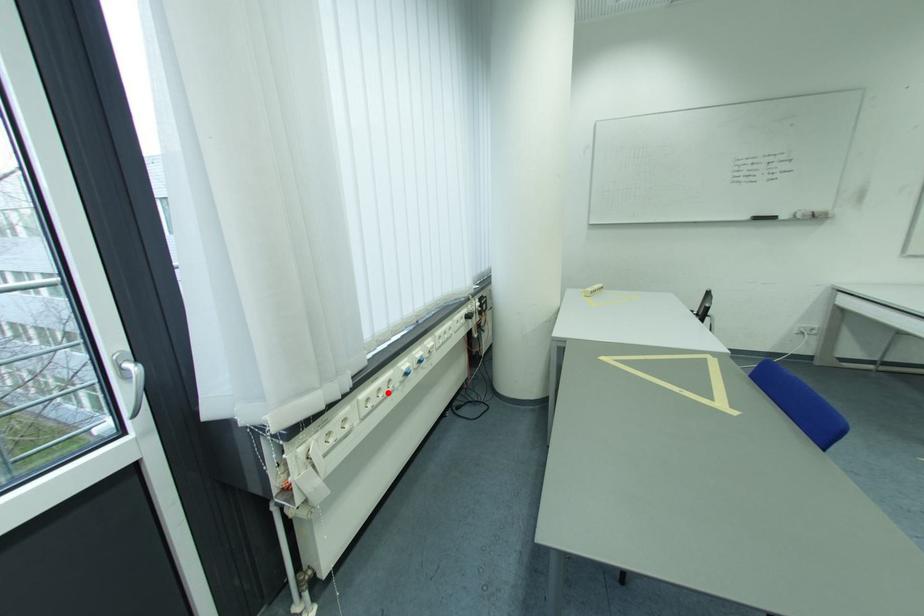
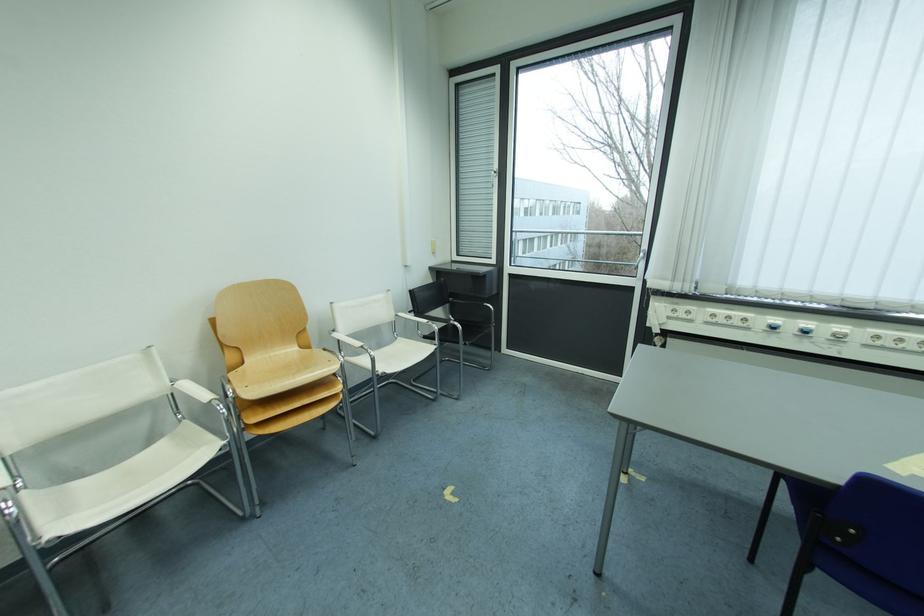
The point at the highlighted location is marked in the first image. Where is the corresponding point in the second image?

(737, 320)